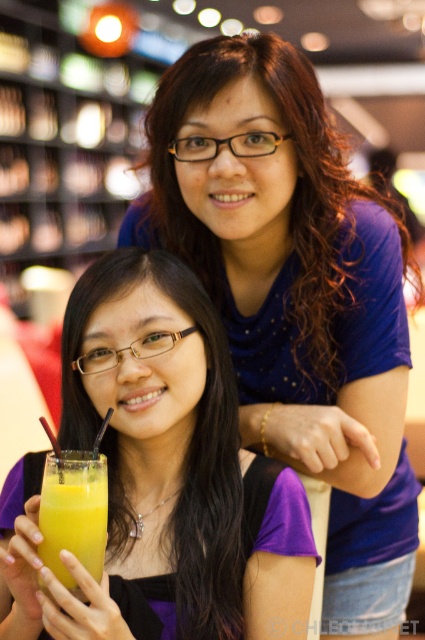
Can you confirm if matte blue shirt at upper center is positioned above orange juice at lower left?

Yes.

Who is lower down, matte blue shirt at upper center or orange juice at lower left?

Positioned lower is orange juice at lower left.

Where is `matte blue shirt at upper center`? The width and height of the screenshot is (425, 640). matte blue shirt at upper center is located at coordinates pyautogui.click(x=294, y=298).

The image size is (425, 640). What are the coordinates of `matte blue shirt at upper center` in the screenshot? It's located at (294, 298).

Is point (363, 436) less distant than point (138, 268)?

No, (363, 436) is behind (138, 268).

Which is in front, point (312, 156) or point (232, 483)?

Point (232, 483) is more forward.

The image size is (425, 640). In order to click on matte blue shirt at upper center in this screenshot , I will do `click(294, 298)`.

Is purple matte shirt at center to the left of orange juice at lower left from the viewer's perspective?

In fact, purple matte shirt at center is to the right of orange juice at lower left.

From the picture: Between purple matte shirt at center and orange juice at lower left, which one has less height?

orange juice at lower left

Who is more distant from viewer, (76,305) or (90,500)?

The point (76,305) is more distant.

Identify the location of purple matte shirt at center. (178, 454).